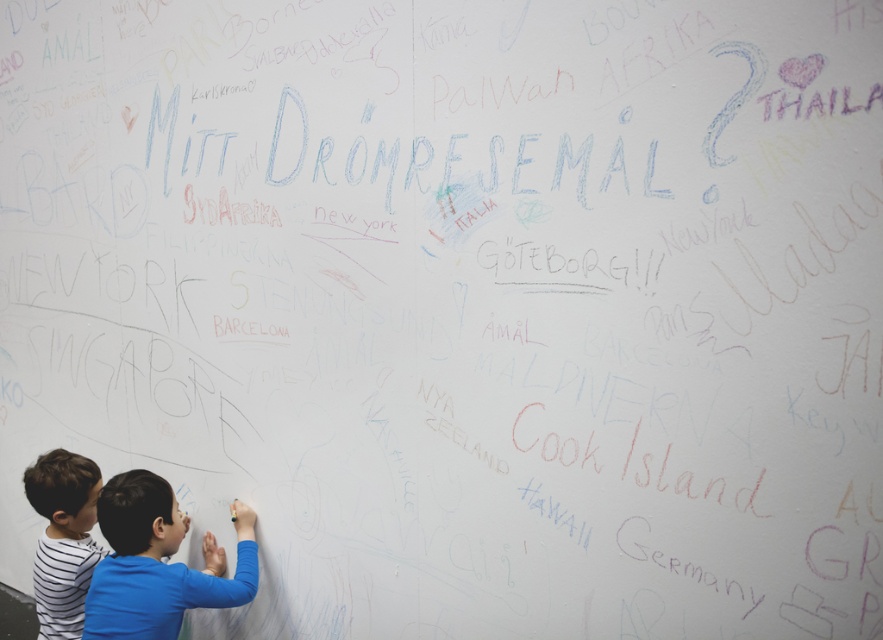
Does point (94, 618) come in front of point (38, 470)?

Yes, it is.

Is point (185, 579) positioned after point (63, 579)?

No, it is not.

In order to click on blue shirt at lower left in this screenshot , I will do `click(157, 563)`.

Find the location of a particular element. This screenshot has height=640, width=883. blue shirt at lower left is located at coordinates (157, 563).